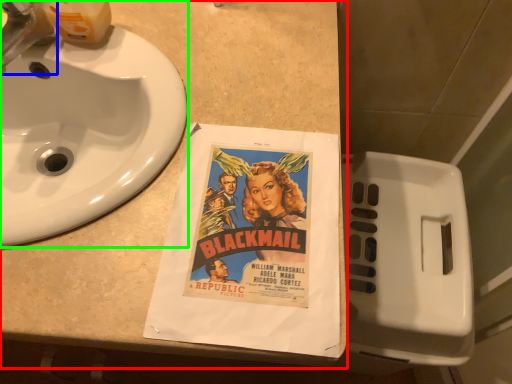
Question: Estimate the real-world distances between objects in this image. Which object is closer to counter top (highlighted by a red box), faucet (highlighted by a blue box) or sink (highlighted by a green box)?

Choices:
 (A) faucet
 (B) sink

Answer: (B)